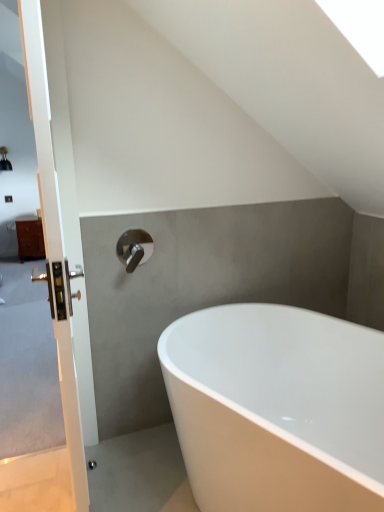
Question: Is white glossy bathtub at center turned away from satin nickel faucet at upper center?

Choices:
 (A) yes
 (B) no

Answer: (B)

Question: Does white glossy bathtub at center come behind satin nickel faucet at upper center?

Choices:
 (A) no
 (B) yes

Answer: (A)

Question: Does white glossy bathtub at center have a greater width compared to satin nickel faucet at upper center?

Choices:
 (A) yes
 (B) no

Answer: (A)

Question: Can you confirm if white glossy bathtub at center is taller than satin nickel faucet at upper center?

Choices:
 (A) yes
 (B) no

Answer: (A)

Question: Can you confirm if white glossy bathtub at center is thinner than satin nickel faucet at upper center?

Choices:
 (A) no
 (B) yes

Answer: (A)

Question: In the image, is white glossy door handle at left on the left side or the right side of white glossy bathtub at center?

Choices:
 (A) left
 (B) right

Answer: (A)

Question: Relative to white glossy bathtub at center, is white glossy door handle at left in front or behind?

Choices:
 (A) front
 (B) behind

Answer: (A)

Question: Is point (39, 503) positioned closer to the camera than point (296, 484)?

Choices:
 (A) closer
 (B) farther

Answer: (B)

Question: From a real-world perspective, is white glossy door handle at left physically located above or below white glossy bathtub at center?

Choices:
 (A) above
 (B) below

Answer: (A)

Question: From their relative heights in the image, would you say white glossy door handle at left is taller or shorter than satin nickel faucet at upper center?

Choices:
 (A) short
 (B) tall

Answer: (B)

Question: From a real-world perspective, is white glossy door handle at left positioned above or below satin nickel faucet at upper center?

Choices:
 (A) below
 (B) above

Answer: (B)

Question: Looking at the image, does white glossy door handle at left seem bigger or smaller compared to satin nickel faucet at upper center?

Choices:
 (A) small
 (B) big

Answer: (B)

Question: Visually, is white glossy door handle at left positioned to the left or to the right of satin nickel faucet at upper center?

Choices:
 (A) right
 (B) left

Answer: (B)

Question: From a real-world perspective, is satin nickel faucet at upper center physically located above or below white glossy bathtub at center?

Choices:
 (A) above
 (B) below

Answer: (A)

Question: Would you say satin nickel faucet at upper center is to the left or to the right of white glossy bathtub at center in the picture?

Choices:
 (A) right
 (B) left

Answer: (B)